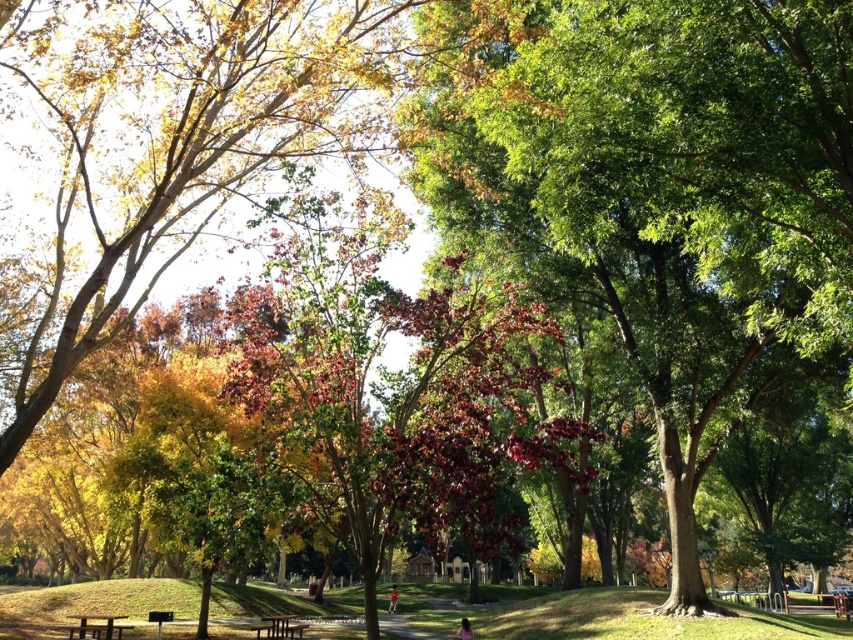
Question: Is green grass at lower center to the right of pink fabric person at lower center from the viewer's perspective?

Choices:
 (A) no
 (B) yes

Answer: (A)

Question: Which object is farther from the camera taking this photo?

Choices:
 (A) green grass at lower center
 (B) pink fabric person at lower center

Answer: (B)

Question: Does green grass at lower center have a greater width compared to pink fabric person at lower center?

Choices:
 (A) yes
 (B) no

Answer: (A)

Question: Which of the following is the farthest from the observer?

Choices:
 (A) [392, 605]
 (B) [469, 636]
 (C) [281, 595]

Answer: (A)

Question: Among these points, which one is nearest to the camera?

Choices:
 (A) (393, 592)
 (B) (238, 609)
 (C) (463, 632)

Answer: (C)

Question: Does green grass at lower center appear over pink fabric person at lower center?

Choices:
 (A) no
 (B) yes

Answer: (A)